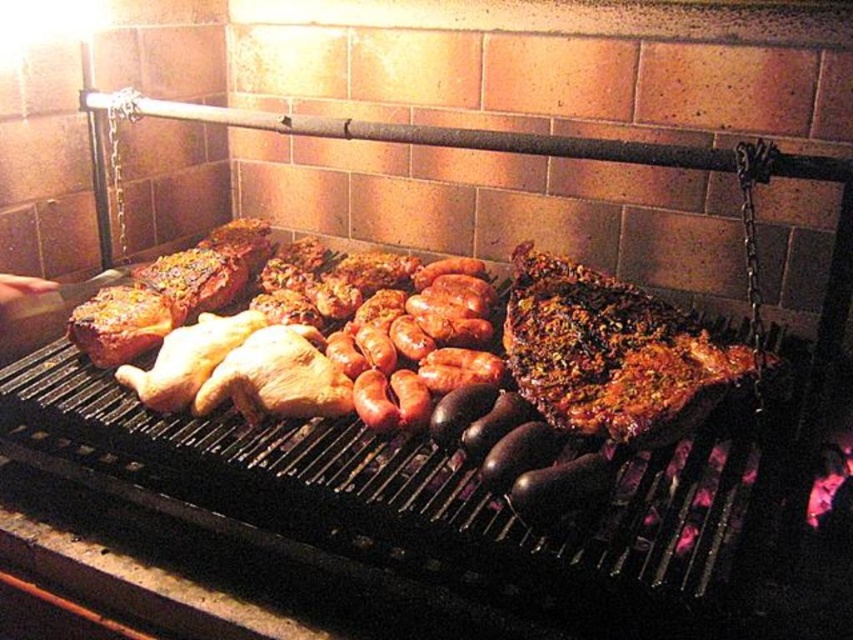
You are a chef preparing food for a party. You need to check the doneness of the shiny brown steak at right and the smooth brown sausages at center. Which one is located to the right of the other?

The shiny brown steak at right is positioned on the right side of smooth brown sausages at center.